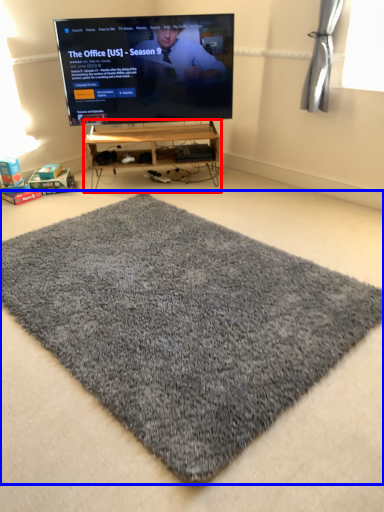
Question: Which of the following is the farthest to the observer, furniture (highlighted by a red box) or mat (highlighted by a blue box)?

Choices:
 (A) furniture
 (B) mat

Answer: (A)